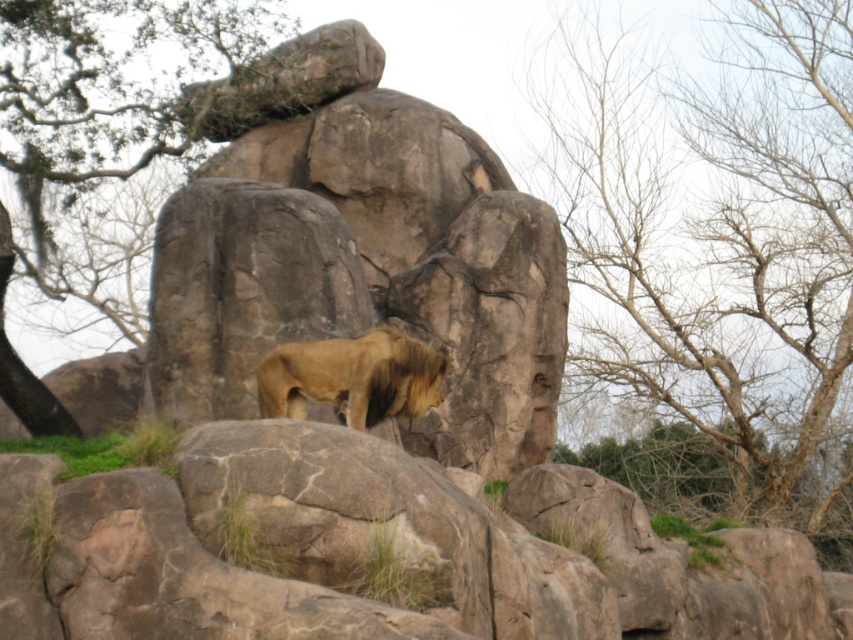
You are a zookeeper observing the lion enclosure. You notice the golden fur lion at center and the green leafy tree at upper left. Which object is positioned higher in the image?

The green leafy tree at upper left is located above the golden fur lion at center, so it is positioned higher in the image.